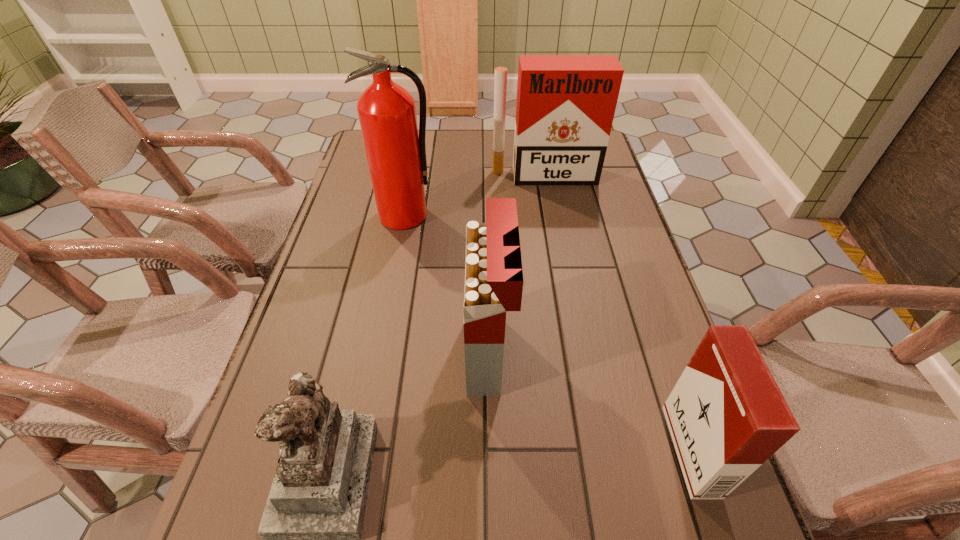
Where is `the second farthest object`? The height and width of the screenshot is (540, 960). the second farthest object is located at coordinates (396, 154).

Where is `the tallest object`? The height and width of the screenshot is (540, 960). the tallest object is located at coordinates (396, 154).

At what (x,y) coordinates should I click in order to perform the action: click on the farthest cigarette_case. Please return your answer as a coordinate pair (x, y). The width and height of the screenshot is (960, 540). Looking at the image, I should click on (565, 106).

Where is `the second nearest cigarette_case`? the second nearest cigarette_case is located at coordinates (494, 281).

I want to click on the nearest cigarette_case, so click(726, 415).

Find the location of `free spot located at the nozzle of the tallest object`. free spot located at the nozzle of the tallest object is located at coordinates (393, 280).

Locate an element on the screen. This screenshot has height=540, width=960. free space located on the front-facing side of the farthest cigarette_case is located at coordinates (x=558, y=254).

The width and height of the screenshot is (960, 540). Identify the location of free spot located with the lid open on the second nearest cigarette_case. (365, 353).

The width and height of the screenshot is (960, 540). Find the location of `vacant space located with the lid open on the second nearest cigarette_case`. vacant space located with the lid open on the second nearest cigarette_case is located at coordinates (321, 353).

Locate an element on the screen. The image size is (960, 540). free space located 0.150m with the lid open on the second nearest cigarette_case is located at coordinates (395, 353).